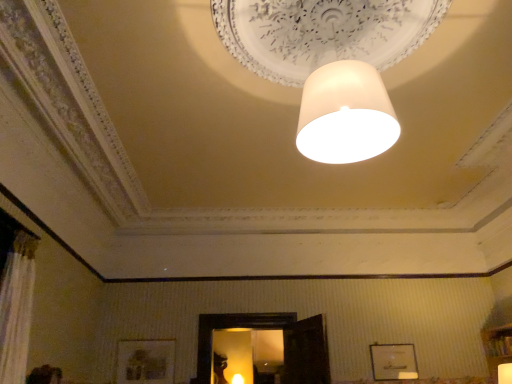
Question: Is matte white lampshade at upper center, marked as the 1th lamp in a bottom-to-top arrangement, in front of or behind wooden picture frame at lower center, the 1th picture frame positioned from the left, in the image?

Choices:
 (A) front
 (B) behind

Answer: (B)

Question: From their relative heights in the image, would you say matte white lampshade at upper center, marked as the 1th lamp in a bottom-to-top arrangement, is taller or shorter than wooden picture frame at lower center, the 1th picture frame positioned from the left?

Choices:
 (A) tall
 (B) short

Answer: (B)

Question: Estimate the real-world distances between objects in this image. Which object is closer to the white matte lampshade at center, which is counted as the second lamp, starting from the left?

Choices:
 (A) matte white lampshade at upper center, which ranks as the first lamp in left-to-right order
 (B) matte white lampshade at upper center, which is counted as the second lamp, starting from the top
 (C) white matte picture frame at lower right, which ranks as the second picture frame in left-to-right order
 (D) wooden picture frame at lower center, the 1th picture frame positioned from the left

Answer: (C)

Question: Estimate the real-world distances between objects in this image. Which object is farther from the matte white lampshade at upper center, which is the third lamp from right to left?

Choices:
 (A) white matte lampshade at center, the 1th lamp when ordered from top to bottom
 (B) matte white lampshade at upper center, which is counted as the second lamp, starting from the top
 (C) white matte picture frame at lower right, the 1th picture frame viewed from the right
 (D) wooden picture frame at lower center, placed as the second picture frame when sorted from right to left

Answer: (A)